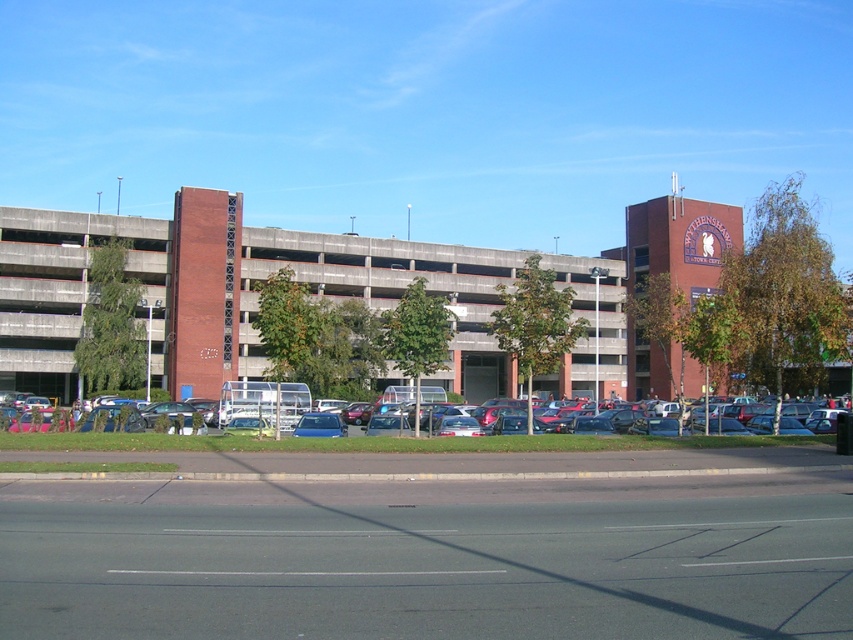
Is asphalt at lower center smaller than metallic silver car at center?

Yes, asphalt at lower center is smaller than metallic silver car at center.

Between asphalt at lower center and metallic silver car at center, which one appears on the right side from the viewer's perspective?

Positioned to the right is asphalt at lower center.

Identify the location of asphalt at lower center. Image resolution: width=853 pixels, height=640 pixels. (430, 570).

Where is `asphalt at lower center`? The height and width of the screenshot is (640, 853). asphalt at lower center is located at coordinates (430, 570).